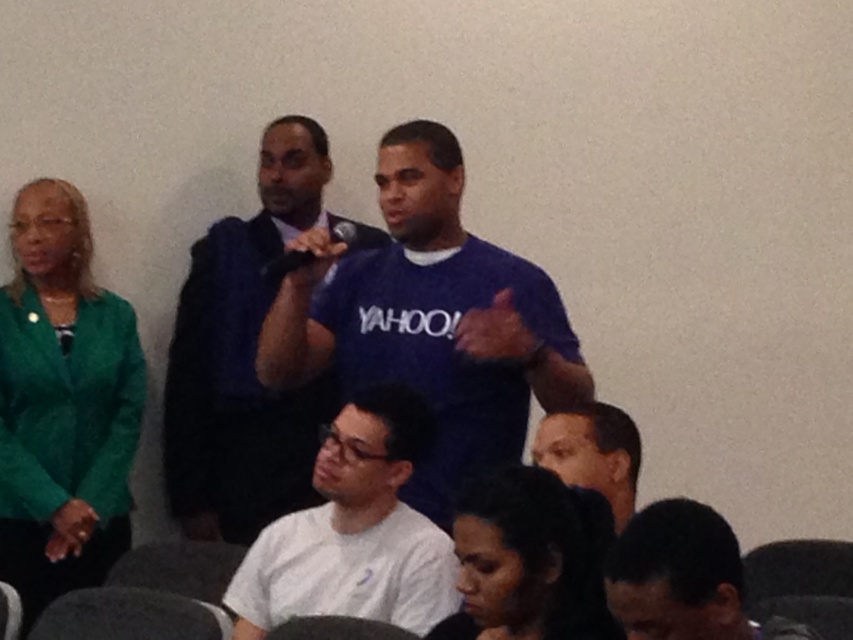
Is the position of white matte shirt at lower center less distant than that of smooth skin face at lower center?

No.

Is white matte shirt at lower center wider than smooth skin face at lower center?

Correct, the width of white matte shirt at lower center exceeds that of smooth skin face at lower center.

Is point (392, 474) farther from viewer compared to point (593, 488)?

No, it is in front of (593, 488).

Find the location of a particular element. white matte shirt at lower center is located at coordinates (352, 531).

Is matte blue shirt at center to the left of dark blue shirt at lower right from the viewer's perspective?

Yes, matte blue shirt at center is to the left of dark blue shirt at lower right.

Is matte blue shirt at center shorter than dark blue shirt at lower right?

No, matte blue shirt at center is not shorter than dark blue shirt at lower right.

Identify the location of matte blue shirt at center. This screenshot has height=640, width=853. (428, 321).

Is point (398, 602) less distant than point (680, 589)?

No.

Between white matte shirt at lower center and dark blue shirt at lower right, which one is positioned higher?

dark blue shirt at lower right

Who is more forward, (x=258, y=616) or (x=642, y=509)?

Positioned in front is point (x=642, y=509).

Where is `white matte shirt at lower center`? The height and width of the screenshot is (640, 853). white matte shirt at lower center is located at coordinates (352, 531).